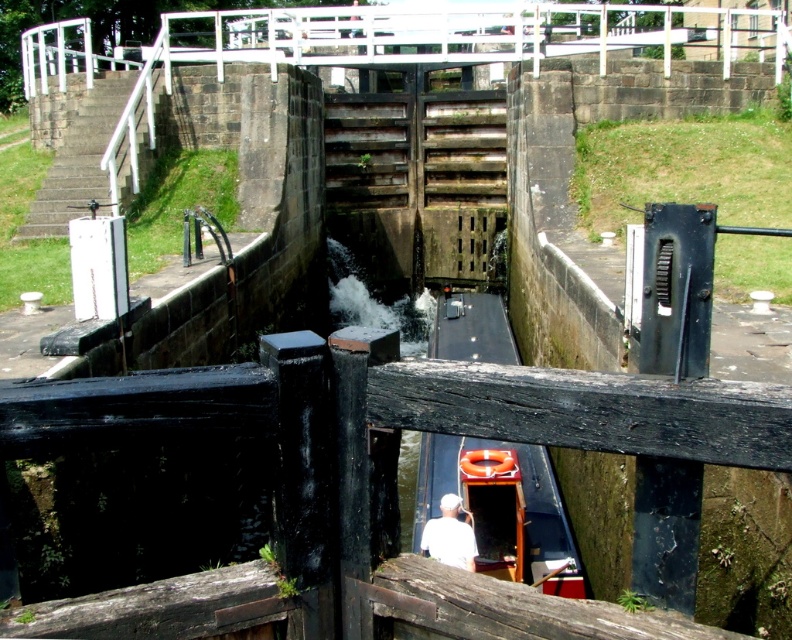
Between wooden boat at center and white fabric at center, which one has more height?

Standing taller between the two is wooden boat at center.

Is wooden boat at center taller than white fabric at center?

Yes, wooden boat at center is taller than white fabric at center.

Is point (565, 529) in front of point (454, 536)?

No.

At what (x,y) coordinates should I click in order to perform the action: click on wooden boat at center. Please return your answer as a coordinate pair (x, y). Image resolution: width=792 pixels, height=640 pixels. Looking at the image, I should click on (501, 508).